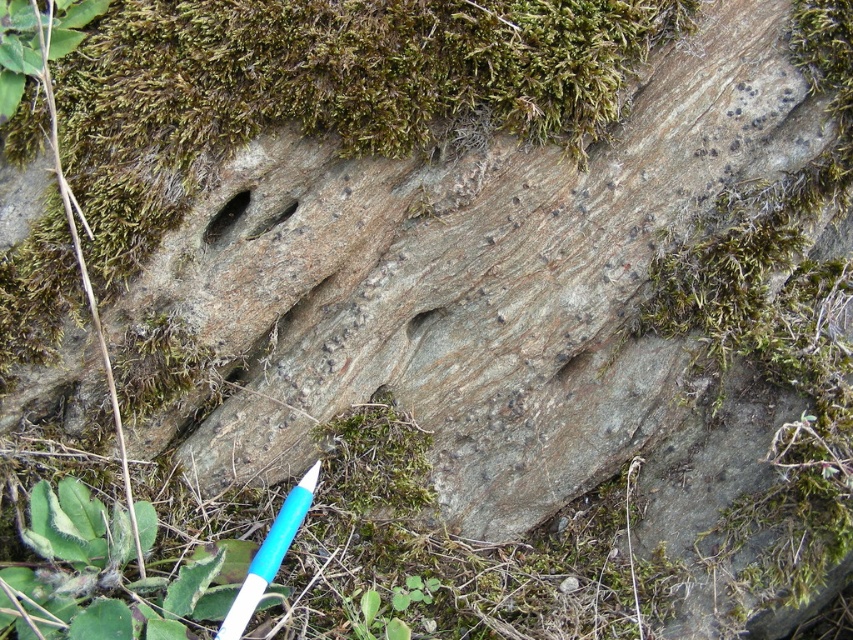
You are a geologist examining the rock surface. You notice the white plastic pen at lower left and the brown rough hole at center. Which object is taller when comparing their heights?

The white plastic pen at lower left is much taller than the brown rough hole at center according to the description.

You are an archaeologist examining the rock surface. You notice the white plastic pen at lower left and the brown rough hole at center. Based on their positions, which object is closer to you?

The white plastic pen at lower left is closer to you because it is in front of the brown rough hole at center.

Based on the photo, you are a geologist examining the rock surface. You notice the green mossy rock at upper center and the smooth stone hole at center. Which object would you need to use a larger magnifying glass to examine in detail?

The green mossy rock at upper center is bigger than the smooth stone hole at center, so you would need to use a larger magnifying glass to examine the green mossy rock at upper center in detail.